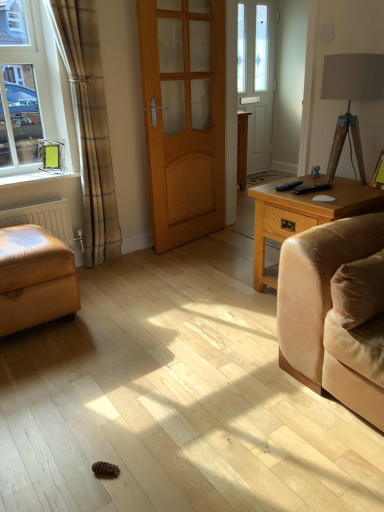
Question: Does point (236, 159) appear closer or farther from the camera than point (59, 250)?

Choices:
 (A) closer
 (B) farther

Answer: (B)

Question: From a real-world perspective, is matte wood cabinet at center physically located above or below leather armchair at left?

Choices:
 (A) above
 (B) below

Answer: (A)

Question: Which object is the closest to the white matte radiator at lower left?

Choices:
 (A) wooden door at center
 (B) white plastic window sill at left
 (C) plaid fabric curtain at left
 (D) suede cushion at right
 (E) leather armchair at left

Answer: (B)

Question: Which object is positioned closest to the matte wood cabinet at center?

Choices:
 (A) plaid fabric curtain at left
 (B) leather armchair at left
 (C) matte gray lampshade at upper right
 (D) white matte radiator at lower left
 (E) suede cushion at right

Answer: (A)